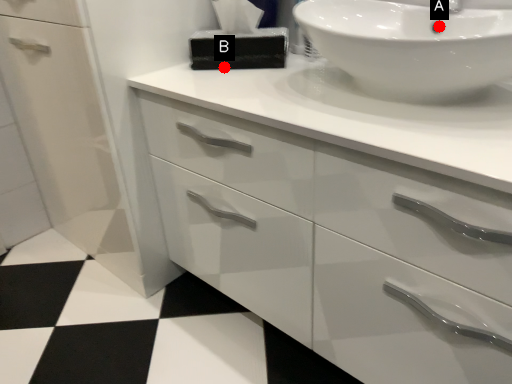
Question: Two points are circled on the image, labeled by A and B beside each circle. Which point appears farthest from the camera in this image?

Choices:
 (A) A is further
 (B) B is further

Answer: (B)